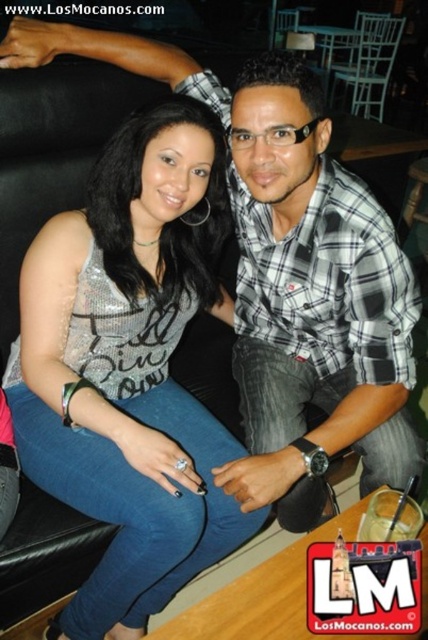
Please determine the coordinates of the satin silver tank top at center in the image. The coordinate system has its origin at the bottom left corner of the image, with the x and y axes increasing to the right and up respectively. The coordinates are normalized between 0 and 1.

The satin silver tank top at center is located at coordinates approximately at point 0.575 in the x axis and 0.304 in the y axis.

You are a photographer setting up for a group photo. You need to ensure that the satin silver tank top at center and the plaid cotton shirt at center are both visible in the frame. Given their heights, which clothing item should you adjust your camera angle to focus on to capture both?

The satin silver tank top at center is taller than the plaid cotton shirt at center. To capture both in the frame, adjust the camera angle to focus on the taller satin silver tank top at center while ensuring the shorter plaid cotton shirt at center remains visible.

You are taking a photo of two people sitting at a bar. The woman is wearing a silver sequined top, and the man is in a plaid shirt. There are two points marked in the image at coordinates point (229, 442) and point (401, 410). Which point is closer to the camera?

Point (229, 442) is closer to the camera than point (401, 410).